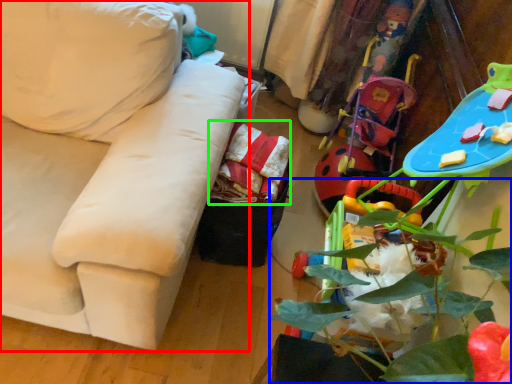
Question: Which is nearer to the studio couch (highlighted by a red box)? plant (highlighted by a blue box) or material (highlighted by a green box).

Choices:
 (A) plant
 (B) material

Answer: (B)